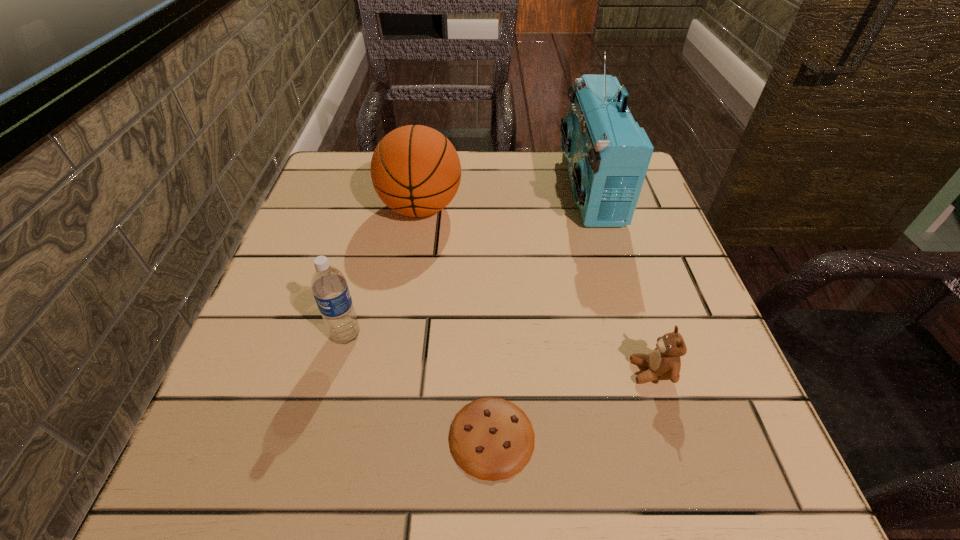
Locate an element on the screen. This screenshot has height=540, width=960. vacant region at the near left corner of the desktop is located at coordinates (234, 492).

Locate an element on the screen. empty space that is in between the water bottle and the radio receiver is located at coordinates (468, 260).

Locate an element on the screen. This screenshot has height=540, width=960. free space between the teddy bear and the shortest object is located at coordinates (571, 404).

Where is `free spot between the radio receiver and the basketball`? free spot between the radio receiver and the basketball is located at coordinates (505, 197).

You are a GUI agent. You are given a task and a screenshot of the screen. Output one action in this format:
    pyautogui.click(x=<x>, y=<y>)
    Task: Click on the free space between the radio receiver and the third nearest object
    The image size is (960, 540).
    Given the screenshot: What is the action you would take?
    pyautogui.click(x=468, y=260)

At what (x,y) coordinates should I click in order to perform the action: click on vacant space that's between the tallest object and the basketball. Please return your answer as a coordinate pair (x, y). The width and height of the screenshot is (960, 540). Looking at the image, I should click on (505, 197).

Identify the location of free space between the third farthest object and the basketball. (x=383, y=271).

Identify the location of vacant space that is in between the teddy bear and the third nearest object. The width and height of the screenshot is (960, 540). (499, 353).

Image resolution: width=960 pixels, height=540 pixels. In order to click on free space between the basketball and the cookie in this screenshot , I will do click(x=456, y=322).

You are a GUI agent. You are given a task and a screenshot of the screen. Output one action in this format:
    pyautogui.click(x=<x>, y=<y>)
    Task: Click on the vacant space that's between the basketball and the third farthest object
    The height and width of the screenshot is (540, 960).
    Given the screenshot: What is the action you would take?
    pyautogui.click(x=383, y=271)